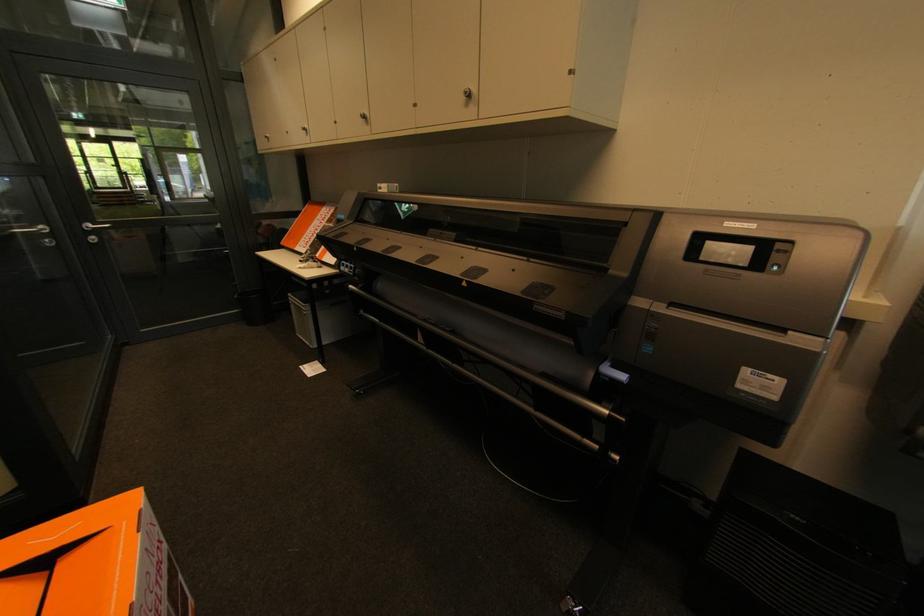
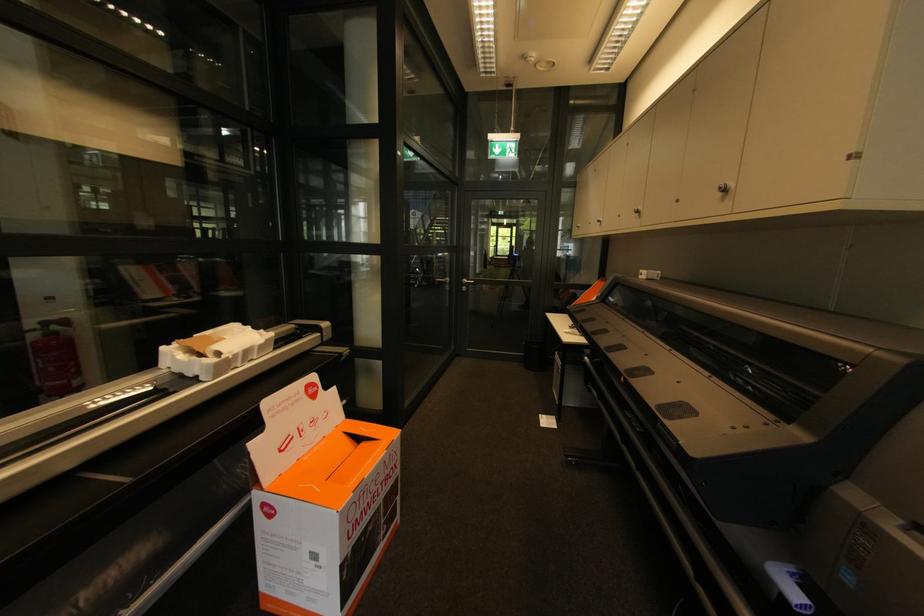
Find the pixel in the second image that matches the point at 574,74 in the first image.

(857, 156)